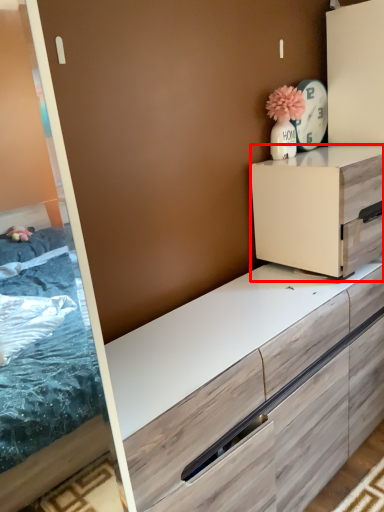
Question: From the image's perspective, what is the correct spatial relationship of chest of drawers (annotated by the red box) in relation to appliance?

Choices:
 (A) above
 (B) below

Answer: (B)